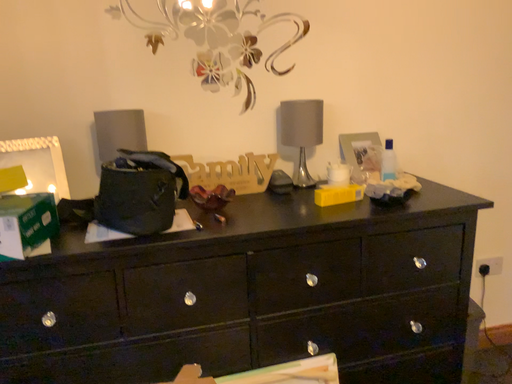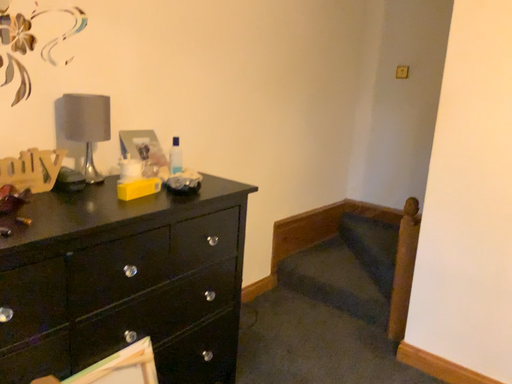
Question: How did the camera likely rotate when shooting the video?

Choices:
 (A) rotated right
 (B) rotated left

Answer: (A)